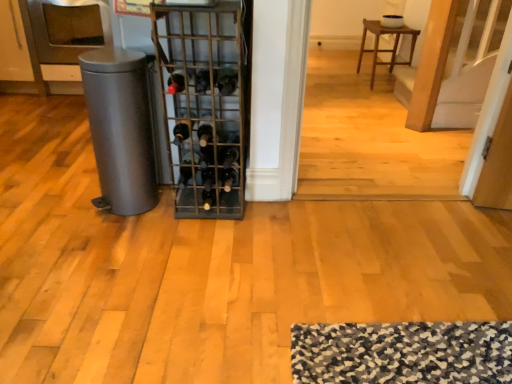
Describe the element at coordinates (227, 81) in the screenshot. I see `black glass wine bottle at center, marked as the 5th wine bottle in a left-to-right arrangement` at that location.

You are a GUI agent. You are given a task and a screenshot of the screen. Output one action in this format:
    pyautogui.click(x=<x>, y=<y>)
    Task: Click on the black glass wine bottle at center, which is counted as the 2th wine bottle, starting from the right
    
    Given the screenshot: What is the action you would take?
    pyautogui.click(x=227, y=81)

Where is `black glass wine bottle at center, acting as the fourth wine bottle starting from the left`? black glass wine bottle at center, acting as the fourth wine bottle starting from the left is located at coordinates (202, 81).

Describe the element at coordinates (230, 177) in the screenshot. I see `black glass wine bottle at center, placed as the 6th wine bottle when sorted from left to right` at that location.

In order to face shiny dark red wine bottle at center, arranged as the fifth wine bottle when viewed from the right, should I rotate leftwards or rightwards?

You should look left and rotate roughly 10.429 degrees.

The image size is (512, 384). I want to click on black glass wine bottle at center, which is counted as the 2th wine bottle, starting from the right, so click(227, 81).

Considering the relative sizes of shiny dark red wine bottle at center, which is the 2th wine bottle in left-to-right order, and black glass wine bottle at center, marked as the 5th wine bottle in a left-to-right arrangement, in the image provided, is shiny dark red wine bottle at center, which is the 2th wine bottle in left-to-right order, wider than black glass wine bottle at center, marked as the 5th wine bottle in a left-to-right arrangement,?

Yes, shiny dark red wine bottle at center, which is the 2th wine bottle in left-to-right order, is wider than black glass wine bottle at center, marked as the 5th wine bottle in a left-to-right arrangement.

How many degrees apart are the facing directions of shiny dark red wine bottle at center, arranged as the fifth wine bottle when viewed from the right, and black glass wine bottle at center, which is counted as the 2th wine bottle, starting from the right?

The facing directions of shiny dark red wine bottle at center, arranged as the fifth wine bottle when viewed from the right, and black glass wine bottle at center, which is counted as the 2th wine bottle, starting from the right, are 0.204 degrees apart.

Is point (175, 93) positioned after point (230, 80)?

Yes, it is behind point (230, 80).

Considering the relative positions of shiny dark red wine bottle at center, arranged as the fifth wine bottle when viewed from the right, and black glass wine bottle at center, marked as the 5th wine bottle in a left-to-right arrangement, in the image provided, is shiny dark red wine bottle at center, arranged as the fifth wine bottle when viewed from the right, to the right of black glass wine bottle at center, marked as the 5th wine bottle in a left-to-right arrangement, from the viewer's perspective?

No, shiny dark red wine bottle at center, arranged as the fifth wine bottle when viewed from the right, is not to the right of black glass wine bottle at center, marked as the 5th wine bottle in a left-to-right arrangement.

Is metallic wire wine rack at center shorter than matte gray trash can at left?

In fact, metallic wire wine rack at center may be taller than matte gray trash can at left.

Is metallic wire wine rack at center completely or partially outside of matte gray trash can at left?

Yes, metallic wire wine rack at center is not within matte gray trash can at left.

From a real-world perspective, which object rests below the other?

From a 3D spatial view, matte gray trash can at left is below.

Between matte gray trash can at left and black glass wine bottle at center, which is the 3th wine bottle from right to left, which one has smaller size?

black glass wine bottle at center, which is the 3th wine bottle from right to left.

Looking at this image, could black glass wine bottle at center, which is the 3th wine bottle from right to left, be considered to be inside matte gray trash can at left?

That's incorrect, black glass wine bottle at center, which is the 3th wine bottle from right to left, is not inside matte gray trash can at left.

Can you confirm if matte gray trash can at left is shorter than black glass wine bottle at center, acting as the fourth wine bottle starting from the left?

No, matte gray trash can at left is not shorter than black glass wine bottle at center, acting as the fourth wine bottle starting from the left.

Is matte gray trash can at left at the left side of black glass wine bottle at center, acting as the fourth wine bottle starting from the left?

Yes.

In the scene shown: Considering the sizes of black glass wine bottle at center, which is the 3th wine bottle from right to left, and shiny dark red wine bottle at center, arranged as the fifth wine bottle when viewed from the right, in the image, is black glass wine bottle at center, which is the 3th wine bottle from right to left, bigger or smaller than shiny dark red wine bottle at center, arranged as the fifth wine bottle when viewed from the right,?

Clearly, black glass wine bottle at center, which is the 3th wine bottle from right to left, is larger in size than shiny dark red wine bottle at center, arranged as the fifth wine bottle when viewed from the right.

Is black glass wine bottle at center, which is the 3th wine bottle from right to left, closer to the viewer compared to shiny dark red wine bottle at center, which is the 2th wine bottle in left-to-right order?

Yes, black glass wine bottle at center, which is the 3th wine bottle from right to left, is in front of shiny dark red wine bottle at center, which is the 2th wine bottle in left-to-right order.

Is black glass wine bottle at center, which is the 3th wine bottle from right to left, facing away from shiny dark red wine bottle at center, which is the 2th wine bottle in left-to-right order?

No, shiny dark red wine bottle at center, which is the 2th wine bottle in left-to-right order, is not at the back of black glass wine bottle at center, which is the 3th wine bottle from right to left.

Which point is more distant from viewer, (203, 89) or (173, 92)?

Point (173, 92)

Considering the relative sizes of black glass wine bottle at center, which appears as the third wine bottle when viewed from the left, and black glass wine bottle at center, the 6th wine bottle from the right, in the image provided, is black glass wine bottle at center, which appears as the third wine bottle when viewed from the left, bigger than black glass wine bottle at center, the 6th wine bottle from the right,?

Yes.

Based on the photo, which is closer to the camera, [205,184] or [186,134]?

Point [205,184]

Is black glass wine bottle at center, marked as the 4th wine bottle in a right-to-left arrangement, at the left side of black glass wine bottle at center, the 6th wine bottle from the right?

No, black glass wine bottle at center, marked as the 4th wine bottle in a right-to-left arrangement, is not to the left of black glass wine bottle at center, the 6th wine bottle from the right.

What's the angular difference between black glass wine bottle at center, marked as the 4th wine bottle in a right-to-left arrangement, and black glass wine bottle at center, the 6th wine bottle from the right,'s facing directions?

0.478 degrees.

Is metallic wire wine rack at center positioned beyond the bounds of brown wooden stool at upper center?

That's correct, metallic wire wine rack at center is outside of brown wooden stool at upper center.

From a real-world perspective, is metallic wire wine rack at center below brown wooden stool at upper center?

No, from a real-world perspective, metallic wire wine rack at center is not below brown wooden stool at upper center.

Considering the relative sizes of metallic wire wine rack at center and brown wooden stool at upper center in the image provided, is metallic wire wine rack at center smaller than brown wooden stool at upper center?

Yes.

Is metallic wire wine rack at center far from brown wooden stool at upper center?

metallic wire wine rack at center is far away from brown wooden stool at upper center.

Considering the positions of objects black glass wine bottle at center, which is counted as the 2th wine bottle, starting from the right, and brown wooden stool at upper center in the image provided, who is more to the right, black glass wine bottle at center, which is counted as the 2th wine bottle, starting from the right, or brown wooden stool at upper center?

brown wooden stool at upper center.

In the scene shown: Is black glass wine bottle at center, marked as the 5th wine bottle in a left-to-right arrangement, not close to brown wooden stool at upper center?

Yes, black glass wine bottle at center, marked as the 5th wine bottle in a left-to-right arrangement, and brown wooden stool at upper center are quite far apart.

Who is more distant, black glass wine bottle at center, marked as the 5th wine bottle in a left-to-right arrangement, or brown wooden stool at upper center?

Positioned behind is brown wooden stool at upper center.

From a real-world perspective, which wine bottle is the 3rd one above the brown wooden stool at upper center? Please provide its 2D coordinates.

[(227, 81)]

Locate an element on the screen. the 1st wine bottle directly above the shiny dark red wine bottle at center, arranged as the fifth wine bottle when viewed from the right (from a real-world perspective) is located at coordinates (227, 81).

Identify the location of appliance below the metallic wire wine rack at center (from a real-world perspective). The width and height of the screenshot is (512, 384). (120, 129).

Looking at the image, which one is located further to black glass wine bottle at center, which is the 3th wine bottle from right to left, black glass wine bottle at center, which is the 1th wine bottle from right to left, or shiny dark red wine bottle at center, which is the 2th wine bottle in left-to-right order?

black glass wine bottle at center, which is the 1th wine bottle from right to left.

When comparing their distances from brown wooden stool at upper center, does black glass wine bottle at center, the first wine bottle from the left, or black glass wine bottle at center, marked as the 4th wine bottle in a right-to-left arrangement, seem further?

black glass wine bottle at center, marked as the 4th wine bottle in a right-to-left arrangement, is positioned further to the anchor brown wooden stool at upper center.

When comparing their distances from black glass wine bottle at center, placed as the 6th wine bottle when sorted from left to right, does black glass wine bottle at center, which is counted as the 2th wine bottle, starting from the right, or black glass wine bottle at center, acting as the fourth wine bottle starting from the left, seem further?

black glass wine bottle at center, acting as the fourth wine bottle starting from the left, is positioned further to the anchor black glass wine bottle at center, placed as the 6th wine bottle when sorted from left to right.

Considering their positions, is black glass wine bottle at center, marked as the 5th wine bottle in a left-to-right arrangement, positioned further to black glass wine bottle at center, which is the 3th wine bottle from right to left, than matte gray trash can at left?

matte gray trash can at left is further to black glass wine bottle at center, which is the 3th wine bottle from right to left.

Considering their positions, is black glass wine bottle at center, placed as the 6th wine bottle when sorted from left to right, positioned further to brown wooden stool at upper center than black glass wine bottle at center, which is counted as the 2th wine bottle, starting from the right?

black glass wine bottle at center, placed as the 6th wine bottle when sorted from left to right, lies further to brown wooden stool at upper center than the other object.

Looking at this image, when comparing their distances from brown wooden stool at upper center, does matte gray trash can at left or black glass wine bottle at center, which is the 1th wine bottle from right to left, seem closer?

black glass wine bottle at center, which is the 1th wine bottle from right to left.

From the image, which object appears to be nearer to black glass wine bottle at center, marked as the 4th wine bottle in a right-to-left arrangement, black glass wine bottle at center, which is counted as the 2th wine bottle, starting from the right, or matte gray trash can at left?

matte gray trash can at left is closer to black glass wine bottle at center, marked as the 4th wine bottle in a right-to-left arrangement.

Based on their spatial positions, is black glass wine bottle at center, placed as the 6th wine bottle when sorted from left to right, or black glass wine bottle at center, which appears as the third wine bottle when viewed from the left, closer to matte gray trash can at left?

The object closer to matte gray trash can at left is black glass wine bottle at center, which appears as the third wine bottle when viewed from the left.

In order to click on shelf between black glass wine bottle at center, acting as the fourth wine bottle starting from the left, and black glass wine bottle at center, which appears as the third wine bottle when viewed from the left, in the vertical direction in this screenshot , I will do `click(203, 103)`.

Find the location of `shelf between matte gray trash can at left and black glass wine bottle at center, placed as the 6th wine bottle when sorted from left to right`. shelf between matte gray trash can at left and black glass wine bottle at center, placed as the 6th wine bottle when sorted from left to right is located at coordinates (203, 103).

The image size is (512, 384). Identify the location of shelf between shiny dark red wine bottle at center, arranged as the fifth wine bottle when viewed from the right, and black glass wine bottle at center, which is the 1th wine bottle from right to left, vertically. (203, 103).

In order to click on appliance between shiny dark red wine bottle at center, which is the 2th wine bottle in left-to-right order, and black glass wine bottle at center, marked as the 4th wine bottle in a right-to-left arrangement, in the vertical direction in this screenshot , I will do `click(120, 129)`.